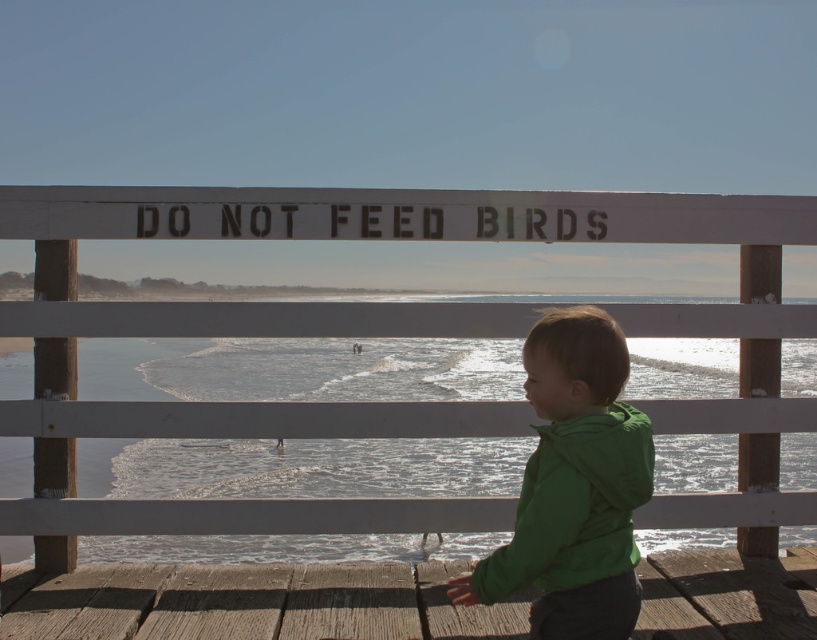
Question: Which point is farther to the camera?

Choices:
 (A) (708, 305)
 (B) (770, 627)
 (C) (648, 451)

Answer: (A)

Question: Which point is closer to the camera taking this photo?

Choices:
 (A) (203, 632)
 (B) (574, 545)
 (C) (668, 460)

Answer: (B)

Question: Where is wooden dock at lower center located in relation to green matte jacket at lower right in the image?

Choices:
 (A) below
 (B) above

Answer: (A)

Question: Can you confirm if wooden dock at lower center is positioned above clear water at lower center?

Choices:
 (A) no
 (B) yes

Answer: (A)

Question: Which object is the farthest from the wooden dock at lower center?

Choices:
 (A) green matte jacket at lower right
 (B) clear water at lower center

Answer: (B)

Question: Is wooden dock at lower center further to camera compared to clear water at lower center?

Choices:
 (A) yes
 (B) no

Answer: (B)